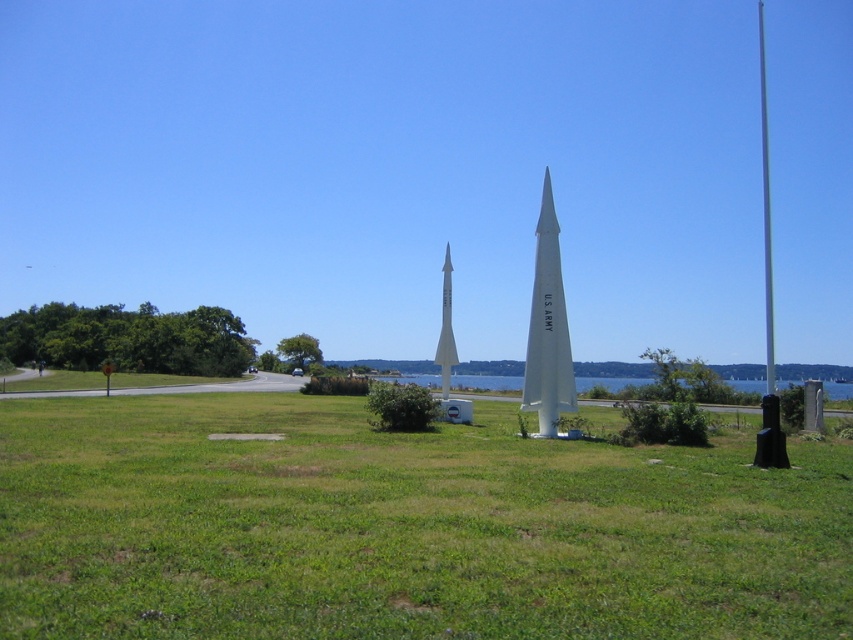
Question: Based on their relative distances, which object is farther from the white matte rocket at center?

Choices:
 (A) silver metallic flag pole at right
 (B) blue water at center

Answer: (A)

Question: Among these points, which one is farthest from the camera?

Choices:
 (A) (537, 408)
 (B) (583, 387)
 (C) (798, 467)
 (D) (762, 205)

Answer: (D)

Question: Can you confirm if blue water at center is smaller than silver metallic flag pole at right?

Choices:
 (A) no
 (B) yes

Answer: (B)

Question: Which of the following is the farthest from the observer?

Choices:
 (A) (450, 289)
 (B) (548, 189)

Answer: (A)

Question: Does white matte us army missile at center appear on the right side of silver metallic flag pole at right?

Choices:
 (A) yes
 (B) no

Answer: (B)

Question: Does green grassy at center appear over white matte rocket at center?

Choices:
 (A) no
 (B) yes

Answer: (A)